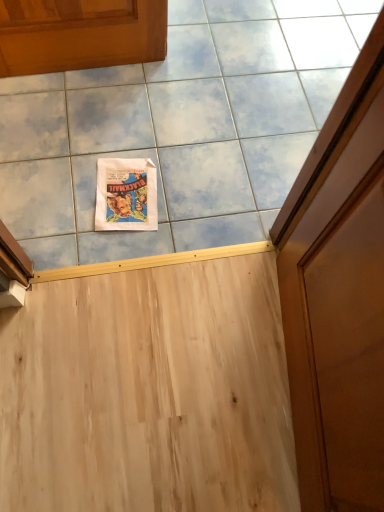
Question: From the image's perspective, relative to white paper poster at upper center, is matte paper comic book at upper center above or below?

Choices:
 (A) above
 (B) below

Answer: (B)

Question: In terms of size, does matte paper comic book at upper center appear bigger or smaller than white paper poster at upper center?

Choices:
 (A) small
 (B) big

Answer: (A)

Question: From a real-world perspective, is matte paper comic book at upper center physically located above or below white paper poster at upper center?

Choices:
 (A) above
 (B) below

Answer: (B)

Question: In terms of width, does white paper poster at upper center look wider or thinner when compared to matte paper comic book at upper center?

Choices:
 (A) wide
 (B) thin

Answer: (A)

Question: Considering the relative positions of white paper poster at upper center and matte paper comic book at upper center in the image provided, is white paper poster at upper center to the left or to the right of matte paper comic book at upper center?

Choices:
 (A) left
 (B) right

Answer: (B)

Question: From a real-world perspective, is white paper poster at upper center positioned above or below matte paper comic book at upper center?

Choices:
 (A) below
 (B) above

Answer: (B)

Question: Considering the positions of point (160, 218) and point (107, 177), is point (160, 218) closer or farther from the camera than point (107, 177)?

Choices:
 (A) farther
 (B) closer

Answer: (B)